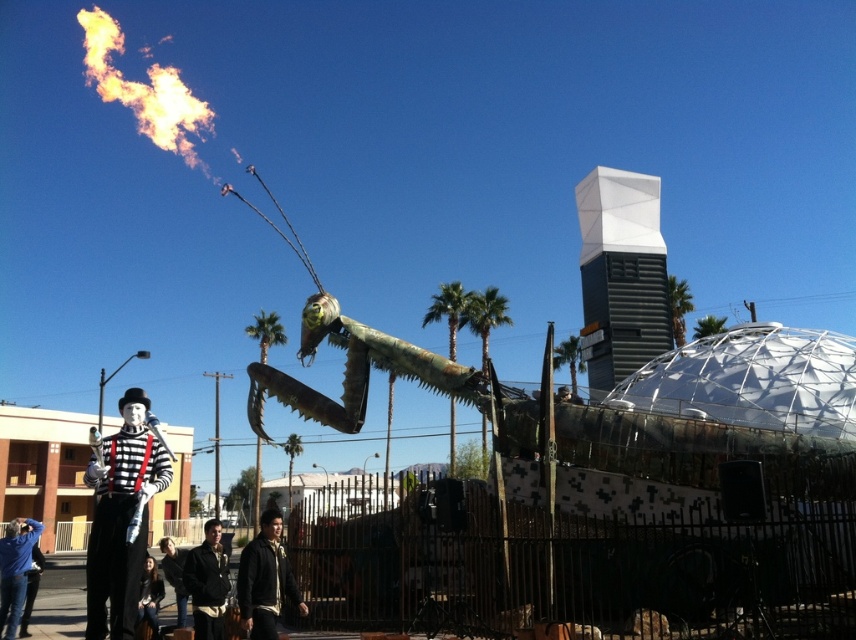
Is dark gray jacket at center shorter than dark brown leather jacket at center?

Correct, dark gray jacket at center is not as tall as dark brown leather jacket at center.

Who is more forward, (275, 584) or (214, 595)?

Point (275, 584) is more forward.

Is point (254, 589) positioned before point (203, 616)?

Yes.

Where is `dark gray jacket at center`? dark gray jacket at center is located at coordinates (265, 579).

Between silver metallic clown at lower left and dark gray jacket at center, which one appears on the right side from the viewer's perspective?

dark gray jacket at center

Which is above, silver metallic clown at lower left or dark gray jacket at center?

silver metallic clown at lower left

At what (x,y) coordinates should I click in order to perform the action: click on silver metallic clown at lower left. Please return your answer as a coordinate pair (x, y). This screenshot has height=640, width=856. Looking at the image, I should click on (122, 516).

This screenshot has height=640, width=856. What are the coordinates of `silver metallic clown at lower left` in the screenshot? It's located at click(122, 516).

Based on the photo, can you confirm if silver metallic clown at lower left is positioned to the right of dark brown leather jacket at center?

In fact, silver metallic clown at lower left is to the left of dark brown leather jacket at center.

Who is more forward, (117, 586) or (191, 564)?

Positioned in front is point (117, 586).

Image resolution: width=856 pixels, height=640 pixels. Find the location of `silver metallic clown at lower left`. silver metallic clown at lower left is located at coordinates (122, 516).